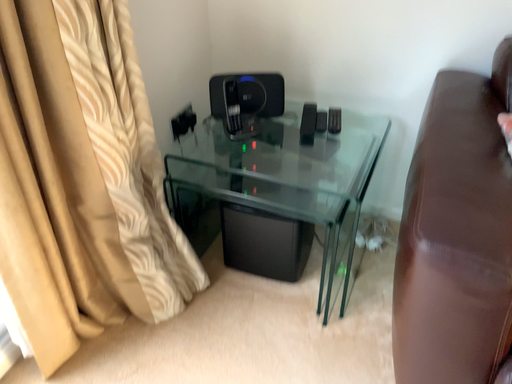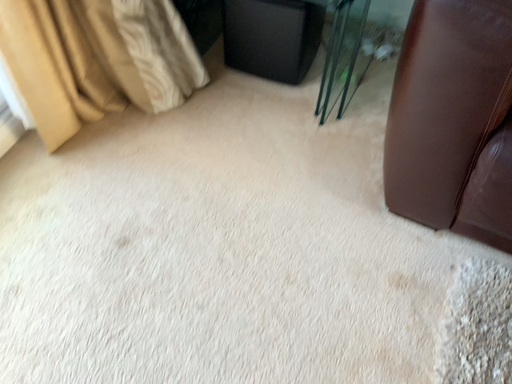
Question: How did the camera likely rotate when shooting the video?

Choices:
 (A) rotated downward
 (B) rotated upward

Answer: (A)